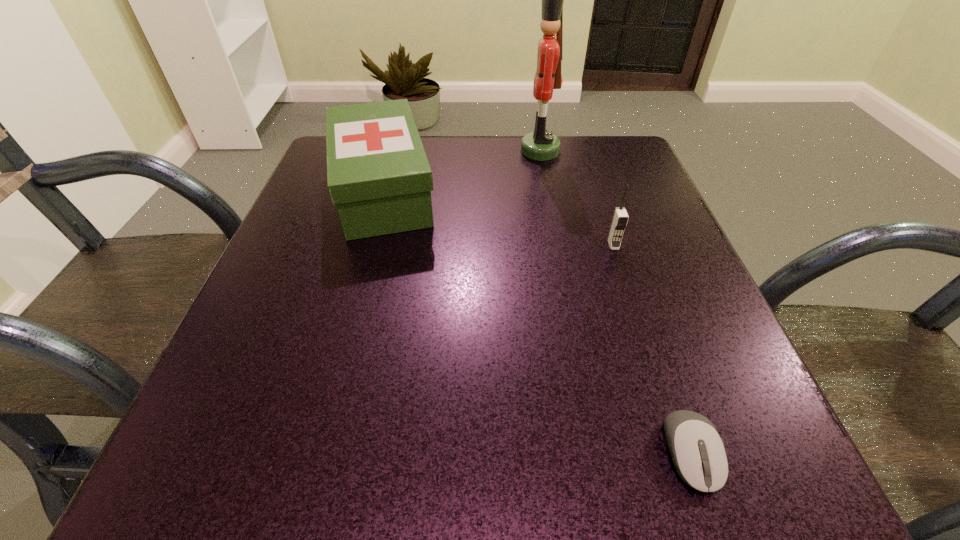
Identify the location of free spot located 0.080m on the front-facing side of the cellular telephone. The height and width of the screenshot is (540, 960). (625, 282).

I want to click on nutcracker situated at the far edge, so click(541, 145).

In order to click on the first-aid kit that is at the far edge in this screenshot , I will do `click(378, 175)`.

The width and height of the screenshot is (960, 540). I want to click on object that is positioned at the near edge, so click(x=698, y=453).

Where is `object located in the left edge section of the desktop`? The width and height of the screenshot is (960, 540). object located in the left edge section of the desktop is located at coordinates (378, 175).

Where is `cellular telephone at the right edge`? The width and height of the screenshot is (960, 540). cellular telephone at the right edge is located at coordinates (620, 218).

Locate an element on the screen. The image size is (960, 540). computer equipment positioned at the right edge is located at coordinates (698, 453).

Find the location of a particular element. This screenshot has height=540, width=960. object that is at the far left corner is located at coordinates (378, 175).

Locate an element on the screen. object present at the near right corner is located at coordinates (698, 453).

The width and height of the screenshot is (960, 540). I want to click on free space at the far edge, so click(566, 150).